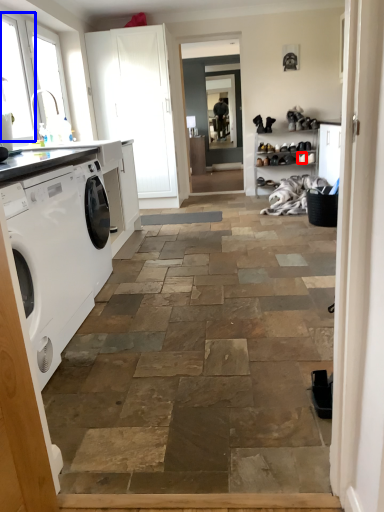
Question: Which object appears closest to the camera in this image, shoe (highlighted by a red box) or window (highlighted by a blue box)?

Choices:
 (A) shoe
 (B) window

Answer: (B)